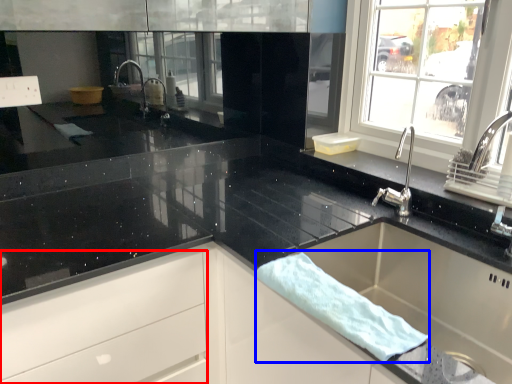
Question: Among these objects, which one is farthest to the camera, drawer (highlighted by a red box) or bath towel (highlighted by a blue box)?

Choices:
 (A) drawer
 (B) bath towel

Answer: (A)